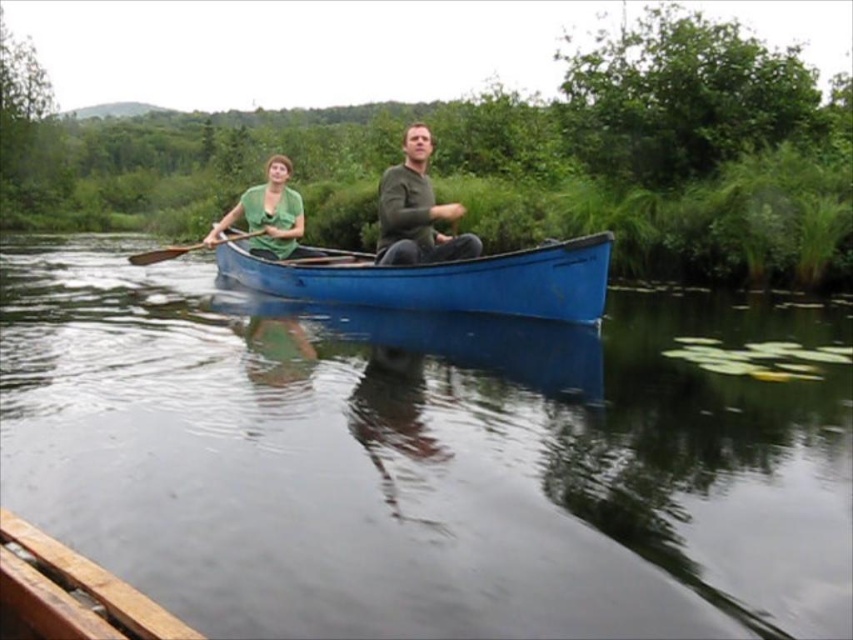
You are in a blue canoe with two people. You see a matte green shirt at center and a wooden paddle at center. Which object is positioned more to the right side of the canoe?

The matte green shirt at center is positioned to the right of the wooden paddle at center, so the matte green shirt at center is more to the right side of the canoe.